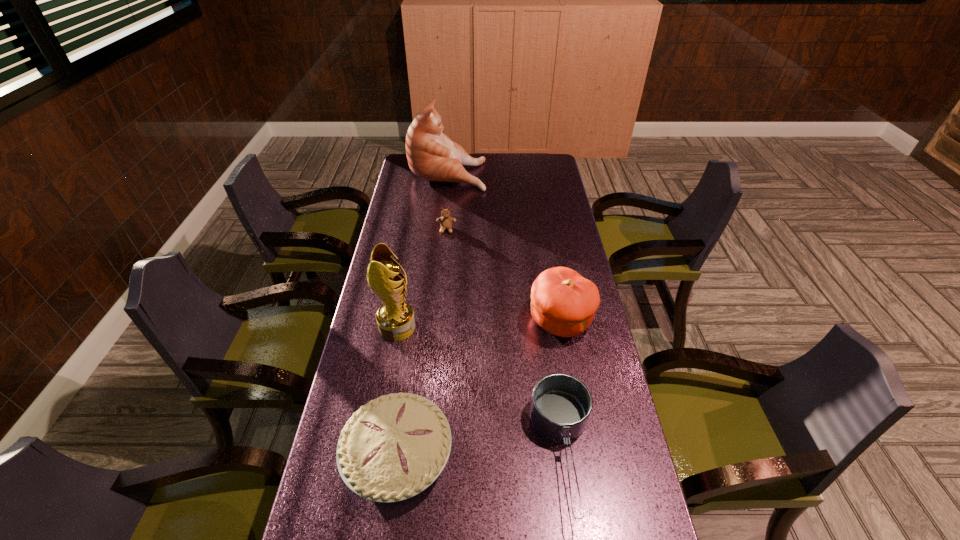
Locate an element on the screen. The image size is (960, 540). free space between the pie and the saucepan is located at coordinates (481, 454).

Choose which object is the fifth nearest neighbor to the cat. Please provide its 2D coordinates. Your answer should be formatted as a tuple, i.e. [(x, y)], where the tuple contains the x and y coordinates of a point satisfying the conditions above.

[(394, 447)]

Image resolution: width=960 pixels, height=540 pixels. I want to click on object that is the fourth closest to the saucepan, so click(x=446, y=221).

Where is `free space in the image that satisfies the following two spatial constraints: 1. on the front-facing side of the fifth nearest object; 2. on the left side of the third tallest object`? free space in the image that satisfies the following two spatial constraints: 1. on the front-facing side of the fifth nearest object; 2. on the left side of the third tallest object is located at coordinates (438, 321).

The image size is (960, 540). I want to click on free space that satisfies the following two spatial constraints: 1. on the front-facing side of the pie; 2. on the right side of the award, so (x=374, y=454).

At what (x,y) coordinates should I click in order to perform the action: click on free space that satisfies the following two spatial constraints: 1. on the front-facing side of the award; 2. on the left side of the pie. Please return your answer as a coordinate pair (x, y). This screenshot has width=960, height=540. Looking at the image, I should click on (374, 454).

This screenshot has width=960, height=540. What are the coordinates of `vacant area that satisfies the following two spatial constraints: 1. on the front-facing side of the teddy bear; 2. on the left side of the fourth shortest object` in the screenshot? It's located at (438, 321).

You are a GUI agent. You are given a task and a screenshot of the screen. Output one action in this format:
    pyautogui.click(x=<x>, y=<y>)
    Task: Click on the free space that satisfies the following two spatial constraints: 1. on the face of the pumpkin; 2. on the right side of the farthest object
    The width and height of the screenshot is (960, 540).
    Given the screenshot: What is the action you would take?
    pyautogui.click(x=432, y=321)